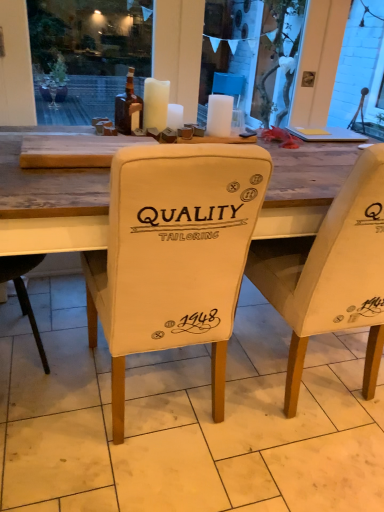
Measure the distance between point (380, 260) and camera.

Point (380, 260) and camera are 4.06 feet apart.

At what (x,y) coordinates should I click in order to perform the action: click on beige fabric chair at center, the 1th chair when ordered from right to left. Please return your answer as a coordinate pair (x, y). The height and width of the screenshot is (512, 384). Looking at the image, I should click on (331, 273).

What do you see at coordinates (219, 115) in the screenshot? I see `white matte candle at upper center, arranged as the 3th candle when viewed from the left` at bounding box center [219, 115].

What do you see at coordinates (183, 418) in the screenshot?
I see `white fabric chair cover at center` at bounding box center [183, 418].

Describe the element at coordinates (174, 254) in the screenshot. I see `beige fabric chair at center, which is counted as the second chair, starting from the right` at that location.

Where is `white matte candle at upper center, which appears as the first candle when viewed from the left`? white matte candle at upper center, which appears as the first candle when viewed from the left is located at coordinates (155, 104).

How much space does white matte candle at center, which is counted as the 2th candle, starting from the right, occupy horizontally?

white matte candle at center, which is counted as the 2th candle, starting from the right, is 7.16 centimeters in width.

The image size is (384, 512). Identify the location of brown glass bottle at upper center. (128, 108).

Is white matte candle at upper center, which is the 1th candle in right-to-left order, wider than beige fabric chair at center, positioned as the second chair in left-to-right order?

No.

At what (x,y) coordinates should I click in order to perform the action: click on candle that is the 2nd object located above the beige fabric chair at center, positioned as the second chair in left-to-right order (from the image's perspective). Please return your answer as a coordinate pair (x, y). This screenshot has width=384, height=512. Looking at the image, I should click on (219, 115).

Does white matte candle at upper center, arranged as the 3th candle when viewed from the left, have a greater height compared to beige fabric chair at center, the 1th chair when ordered from right to left?

No.

From a real-world perspective, is white matte candle at upper center, which is the 1th candle in right-to-left order, over beige fabric chair at center, the 1th chair when ordered from right to left?

Yes, from a real-world perspective, white matte candle at upper center, which is the 1th candle in right-to-left order, is on top of beige fabric chair at center, the 1th chair when ordered from right to left.

From the brown glass bottle at upper center, count 2nd chairs forward and point to it. Please provide its 2D coordinates.

[(174, 254)]

From a real-world perspective, is beige fabric chair at center, the 1th chair positioned from the left, positioned under brown glass bottle at upper center based on gravity?

Correct, in the physical world, beige fabric chair at center, the 1th chair positioned from the left, is lower than brown glass bottle at upper center.

Between point (234, 278) and point (122, 120), which one is positioned behind?

The point (122, 120) is farther.

Is beige fabric chair at center, which is counted as the second chair, starting from the right, with brown glass bottle at upper center?

No, beige fabric chair at center, which is counted as the second chair, starting from the right, is not with brown glass bottle at upper center.

From a real-world perspective, is beige fabric chair at center, the 1th chair when ordered from right to left, on white fabric chair cover at center?

Yes, from a real-world perspective, beige fabric chair at center, the 1th chair when ordered from right to left, is above white fabric chair cover at center.

Is beige fabric chair at center, the 1th chair when ordered from right to left, facing away from white fabric chair cover at center?

No, white fabric chair cover at center is not at the back of beige fabric chair at center, the 1th chair when ordered from right to left.

In terms of size, does beige fabric chair at center, positioned as the second chair in left-to-right order, appear bigger or smaller than white fabric chair cover at center?

beige fabric chair at center, positioned as the second chair in left-to-right order, is bigger than white fabric chair cover at center.

Between beige fabric chair at center, the 1th chair when ordered from right to left, and white fabric chair cover at center, which one has less height?

Standing shorter between the two is white fabric chair cover at center.

Is point (259, 397) positioned behind point (303, 362)?

No, it is in front of (303, 362).

Is white fabric chair cover at center in front of or behind beige fabric chair at center, positioned as the second chair in left-to-right order, in the image?

white fabric chair cover at center is positioned closer to the viewer than beige fabric chair at center, positioned as the second chair in left-to-right order.

Is white fabric chair cover at center thinner than beige fabric chair at center, the 1th chair when ordered from right to left?

Incorrect, the width of white fabric chair cover at center is not less than that of beige fabric chair at center, the 1th chair when ordered from right to left.

The image size is (384, 512). What are the coordinates of `tile lying on the left of beige fabric chair at center, positioned as the second chair in left-to-right order` in the screenshot? It's located at tap(183, 418).

Considering the sizes of white matte candle at center, which is counted as the second candle, starting from the left, and white matte candle at upper center, which appears as the first candle when viewed from the left, in the image, is white matte candle at center, which is counted as the second candle, starting from the left, wider or thinner than white matte candle at upper center, which appears as the first candle when viewed from the left,?

In the image, white matte candle at center, which is counted as the second candle, starting from the left, appears to be more narrow than white matte candle at upper center, which appears as the first candle when viewed from the left.

How much distance is there between white matte candle at center, which is counted as the 2th candle, starting from the right, and white matte candle at upper center, which appears as the first candle when viewed from the left?

8.02 centimeters.

Does white matte candle at center, which is counted as the second candle, starting from the left, have a larger size compared to white matte candle at upper center, which appears as the first candle when viewed from the left?

Actually, white matte candle at center, which is counted as the second candle, starting from the left, might be smaller than white matte candle at upper center, which appears as the first candle when viewed from the left.

Which candle is the 2nd one when counting from the front of the white matte candle at center, which is counted as the 2th candle, starting from the right? Please provide its 2D coordinates.

[(155, 104)]

Is white fabric chair cover at center bigger than white matte candle at upper center, which appears as the first candle when viewed from the left?

Yes, white fabric chair cover at center is bigger than white matte candle at upper center, which appears as the first candle when viewed from the left.

From the image's perspective, is white fabric chair cover at center below white matte candle at upper center, which appears as the first candle when viewed from the left?

Yes.

Which is more to the left, white fabric chair cover at center or white matte candle at upper center, which appears as the first candle when viewed from the left?

white matte candle at upper center, which appears as the first candle when viewed from the left, is more to the left.

Which of these two, white fabric chair cover at center or white matte candle at upper center, which appears as the first candle when viewed from the left, is thinner?

Thinner between the two is white matte candle at upper center, which appears as the first candle when viewed from the left.

Which object is positioned more to the right, white matte candle at upper center, which appears as the first candle when viewed from the left, or white fabric chair cover at center?

white fabric chair cover at center is more to the right.

Can you tell me how much white matte candle at upper center, which appears as the first candle when viewed from the left, and white fabric chair cover at center differ in facing direction?

The angle between the facing direction of white matte candle at upper center, which appears as the first candle when viewed from the left, and the facing direction of white fabric chair cover at center is 90.1 degrees.

Does white matte candle at upper center, which appears as the first candle when viewed from the left, lie behind white fabric chair cover at center?

Yes, white matte candle at upper center, which appears as the first candle when viewed from the left, is further from the camera.

From the image's perspective, relative to white fabric chair cover at center, is white matte candle at upper center, which ranks as the third candle in right-to-left order, above or below?

white matte candle at upper center, which ranks as the third candle in right-to-left order, is situated higher than white fabric chair cover at center in the image.

Where is `candle that is the 2nd one above the beige fabric chair at center, the 1th chair when ordered from right to left (from a real-world perspective)`? This screenshot has width=384, height=512. candle that is the 2nd one above the beige fabric chair at center, the 1th chair when ordered from right to left (from a real-world perspective) is located at coordinates (219, 115).

Where is `bottle behind the beige fabric chair at center, the 1th chair positioned from the left`? The height and width of the screenshot is (512, 384). bottle behind the beige fabric chair at center, the 1th chair positioned from the left is located at coordinates (128, 108).

From the image, which object appears to be farther from white matte candle at center, which is counted as the 2th candle, starting from the right, brown glass bottle at upper center or white matte candle at upper center, which ranks as the third candle in right-to-left order?

Based on the image, brown glass bottle at upper center appears to be further to white matte candle at center, which is counted as the 2th candle, starting from the right.

Based on their spatial positions, is brown glass bottle at upper center or beige fabric chair at center, positioned as the second chair in left-to-right order, further from white matte candle at upper center, which ranks as the third candle in right-to-left order?

Among the two, beige fabric chair at center, positioned as the second chair in left-to-right order, is located further to white matte candle at upper center, which ranks as the third candle in right-to-left order.

Which object lies nearer to the anchor point beige fabric chair at center, the 1th chair when ordered from right to left, white matte candle at center, which is counted as the 2th candle, starting from the right, or white matte candle at upper center, which is the 1th candle in right-to-left order?

white matte candle at upper center, which is the 1th candle in right-to-left order, is positioned closer to the anchor beige fabric chair at center, the 1th chair when ordered from right to left.

Looking at the image, which one is located closer to beige fabric chair at center, which is counted as the second chair, starting from the right, white matte candle at center, which is counted as the 2th candle, starting from the right, or white matte candle at upper center, arranged as the 3th candle when viewed from the left?

white matte candle at upper center, arranged as the 3th candle when viewed from the left, is positioned closer to the anchor beige fabric chair at center, which is counted as the second chair, starting from the right.

Considering their positions, is beige fabric chair at center, the 1th chair positioned from the left, positioned closer to white matte candle at center, which is counted as the 2th candle, starting from the right, than beige fabric chair at center, the 1th chair when ordered from right to left?

beige fabric chair at center, the 1th chair positioned from the left, is closer to white matte candle at center, which is counted as the 2th candle, starting from the right.

Which object lies nearer to the anchor point white matte candle at upper center, which ranks as the third candle in right-to-left order, brown glass bottle at upper center or white fabric chair cover at center?

Based on the image, brown glass bottle at upper center appears to be nearer to white matte candle at upper center, which ranks as the third candle in right-to-left order.

From the image, which object appears to be farther from beige fabric chair at center, positioned as the second chair in left-to-right order, brown glass bottle at upper center or white matte candle at center, which is counted as the 2th candle, starting from the right?

Answer: white matte candle at center, which is counted as the 2th candle, starting from the right, is positioned further to the anchor beige fabric chair at center, positioned as the second chair in left-to-right order.

Looking at this image, when comparing their distances from white matte candle at center, which is counted as the second candle, starting from the left, does white fabric chair cover at center or white matte candle at upper center, which appears as the first candle when viewed from the left, seem further?

white fabric chair cover at center is further to white matte candle at center, which is counted as the second candle, starting from the left.

At what (x,y) coordinates should I click in order to perform the action: click on bottle positioned between beige fabric chair at center, the 1th chair positioned from the left, and white matte candle at upper center, which is the 1th candle in right-to-left order, from near to far. Please return your answer as a coordinate pair (x, y). This screenshot has width=384, height=512. Looking at the image, I should click on tap(128, 108).

I want to click on tile between beige fabric chair at center, which is counted as the second chair, starting from the right, and beige fabric chair at center, the 1th chair when ordered from right to left, in the horizontal direction, so click(183, 418).

This screenshot has height=512, width=384. I want to click on candle between white matte candle at upper center, arranged as the 3th candle when viewed from the left, and white fabric chair cover at center from top to bottom, so click(x=175, y=116).

Identify the location of chair between beige fabric chair at center, the 1th chair positioned from the left, and white matte candle at center, which is counted as the 2th candle, starting from the right, along the z-axis. The image size is (384, 512). (331, 273).